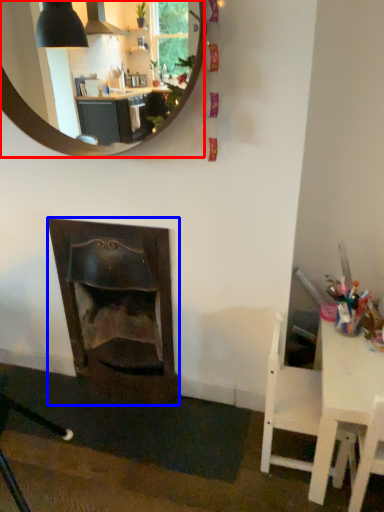
Question: Which of the following is the farthest to the observer, mirror (highlighted by a red box) or fireplace (highlighted by a blue box)?

Choices:
 (A) mirror
 (B) fireplace

Answer: (B)